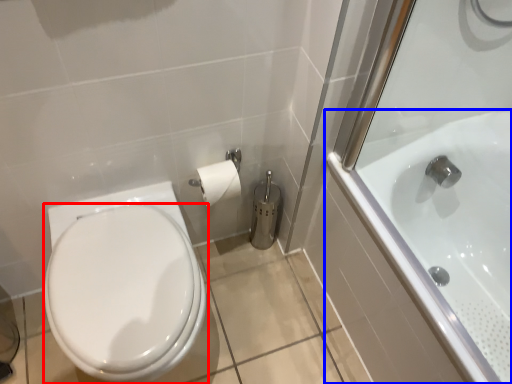
Question: Which point is closer to the camera, bidet (highlighted by a red box) or bathtub (highlighted by a blue box)?

Choices:
 (A) bidet
 (B) bathtub

Answer: (B)